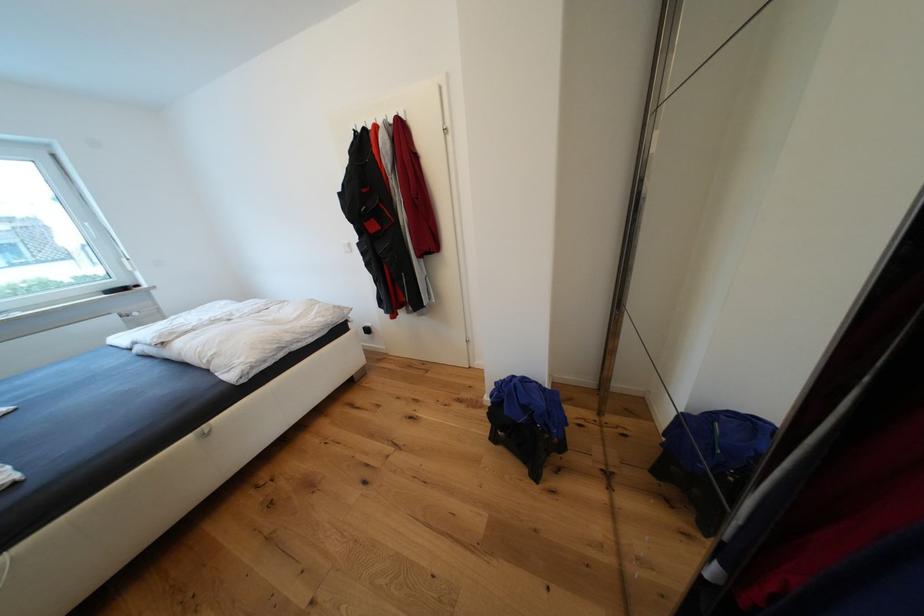
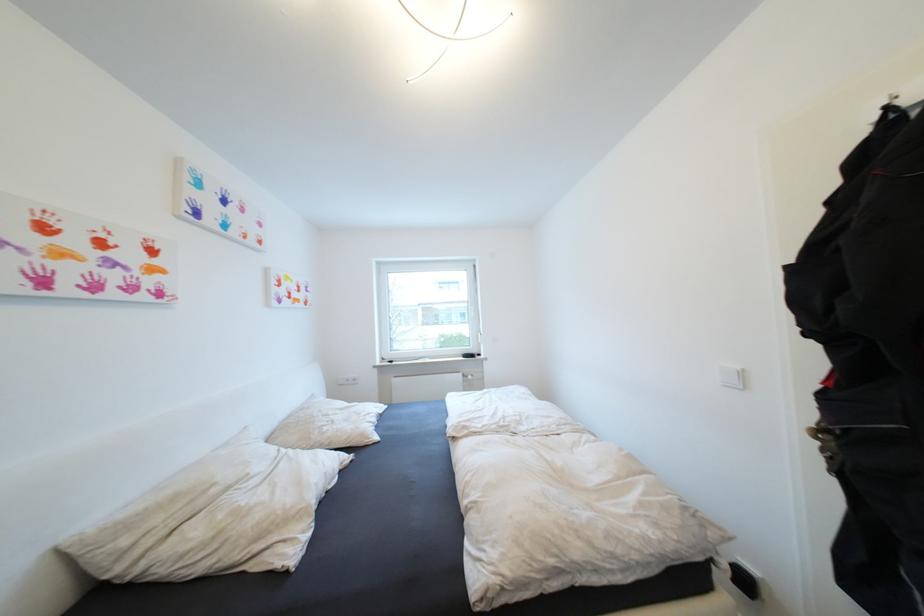
In the second image, find the point that corresponds to point (77, 282) in the first image.

(476, 338)